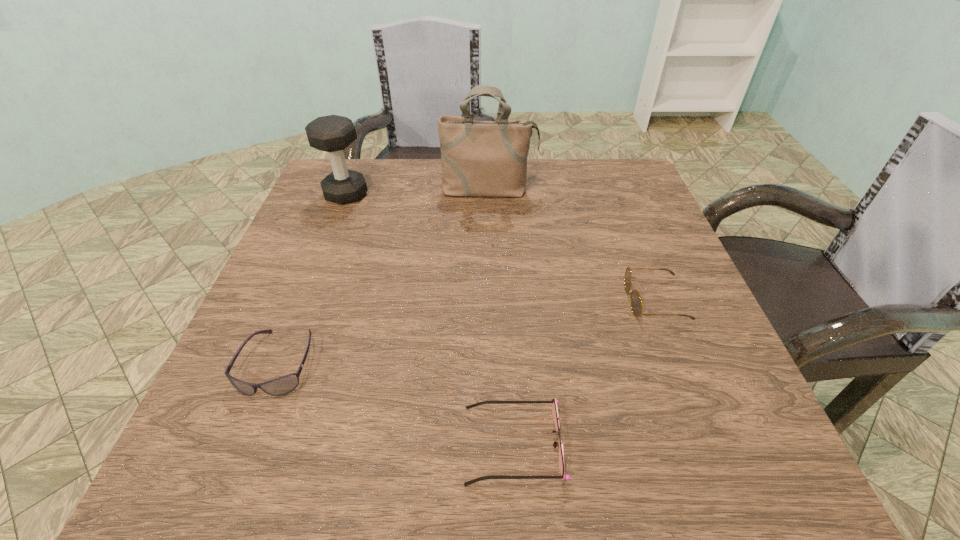
Where is `unoccupied area between the leftmost sunglasses and the shoulder bag`? Image resolution: width=960 pixels, height=540 pixels. unoccupied area between the leftmost sunglasses and the shoulder bag is located at coordinates (383, 277).

At what (x,y) coordinates should I click in order to perform the action: click on free point between the tallest object and the dumbbell. Please return your answer as a coordinate pair (x, y). Image resolution: width=960 pixels, height=540 pixels. Looking at the image, I should click on (418, 192).

Find the location of `vacant space that's between the leftmost sunglasses and the fourth shortest object`. vacant space that's between the leftmost sunglasses and the fourth shortest object is located at coordinates (312, 279).

Image resolution: width=960 pixels, height=540 pixels. I want to click on vacant area between the dumbbell and the nearest object, so click(x=430, y=319).

Locate an element on the screen. free spot between the fourth shortest object and the shoulder bag is located at coordinates (418, 192).

At what (x,y) coordinates should I click in order to perform the action: click on blank region between the second farthest sunglasses and the tallest object. Please return your answer as a coordinate pair (x, y). Looking at the image, I should click on (383, 277).

In order to click on free space between the second sunglasses from left to right and the second nearest sunglasses in this screenshot , I will do `click(396, 403)`.

Locate an element on the screen. free spot between the second tallest object and the farthest sunglasses is located at coordinates [x=500, y=247].

Where is `vacant space that's between the nearest sunglasses and the farthest sunglasses`? Image resolution: width=960 pixels, height=540 pixels. vacant space that's between the nearest sunglasses and the farthest sunglasses is located at coordinates (584, 372).

Locate an element on the screen. This screenshot has height=540, width=960. free space between the shoulder bag and the second sunglasses from right to left is located at coordinates (501, 318).